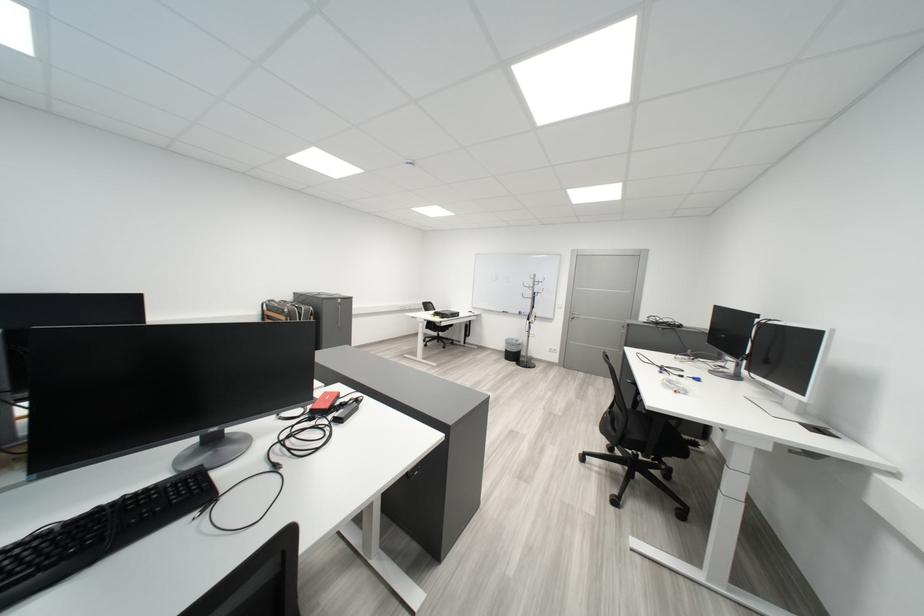
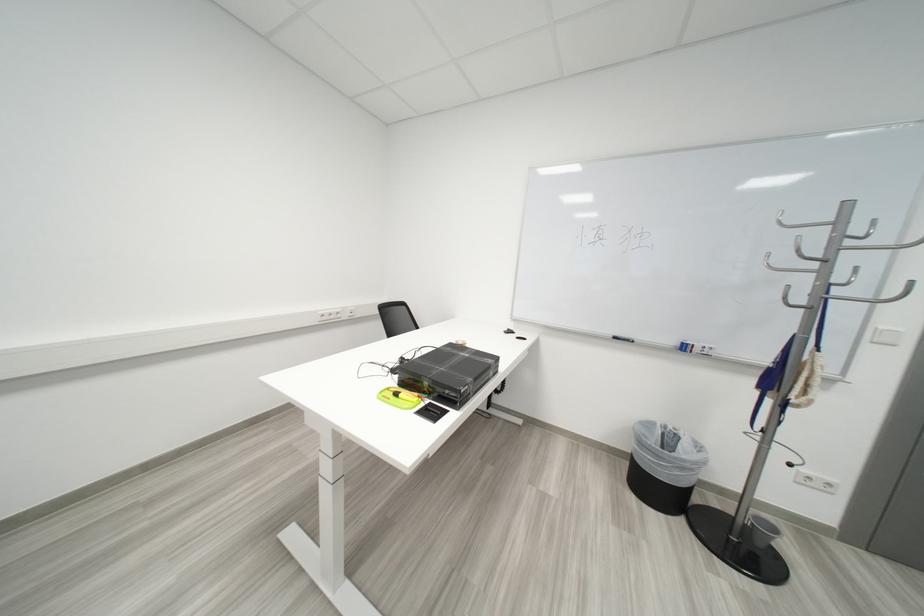
Find the pixel in the second image that matches pixel 548 284 in the first image.

(853, 238)